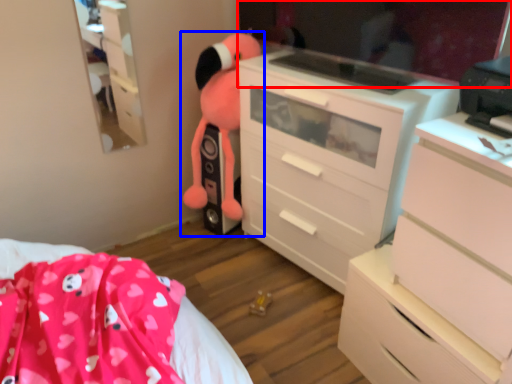
Question: Which point is further to the camera, mirror (highlighted by a red box) or toy (highlighted by a blue box)?

Choices:
 (A) mirror
 (B) toy

Answer: (B)